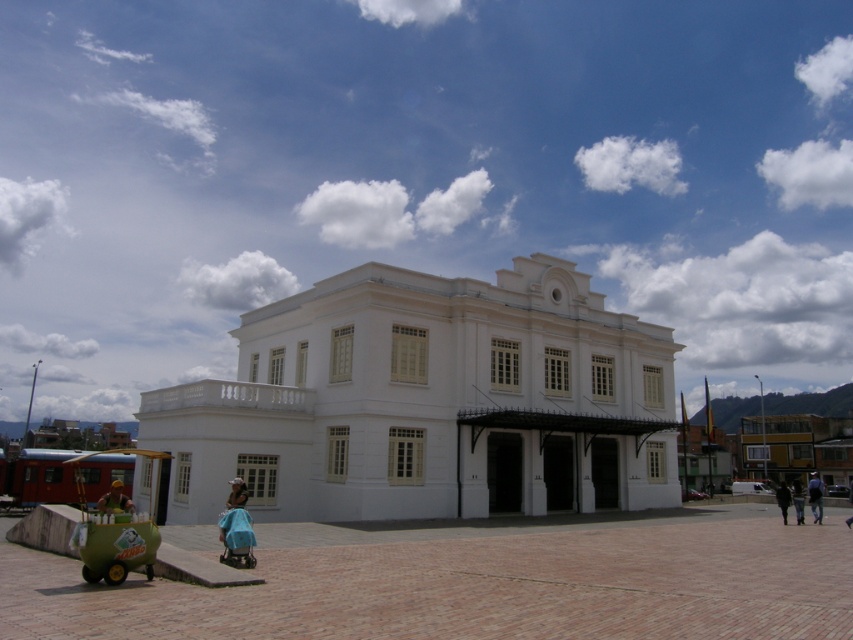
Is green fabric umbrella at lower left to the right of blue denim jeans at lower right from the viewer's perspective?

No, green fabric umbrella at lower left is not to the right of blue denim jeans at lower right.

Between green fabric umbrella at lower left and blue denim jeans at lower right, which one has more height?

blue denim jeans at lower right

The height and width of the screenshot is (640, 853). I want to click on green fabric umbrella at lower left, so click(x=114, y=499).

Who is higher up, blue denim jeans at lower right or dark blue fabric at lower right?

Positioned higher is blue denim jeans at lower right.

Between point (808, 499) and point (785, 490), which one is positioned in front?

Point (785, 490) is in front.

The height and width of the screenshot is (640, 853). What do you see at coordinates (815, 497) in the screenshot?
I see `blue denim jeans at lower right` at bounding box center [815, 497].

Image resolution: width=853 pixels, height=640 pixels. Identify the location of blue denim jeans at lower right. (815, 497).

Between point (248, 554) and point (817, 476), which one is positioned in front?

Point (248, 554)

In the scene shown: Is blue satin dress at lower center to the left of blue denim jeans at lower right from the viewer's perspective?

Correct, you'll find blue satin dress at lower center to the left of blue denim jeans at lower right.

Find the location of a particular element. blue satin dress at lower center is located at coordinates (236, 528).